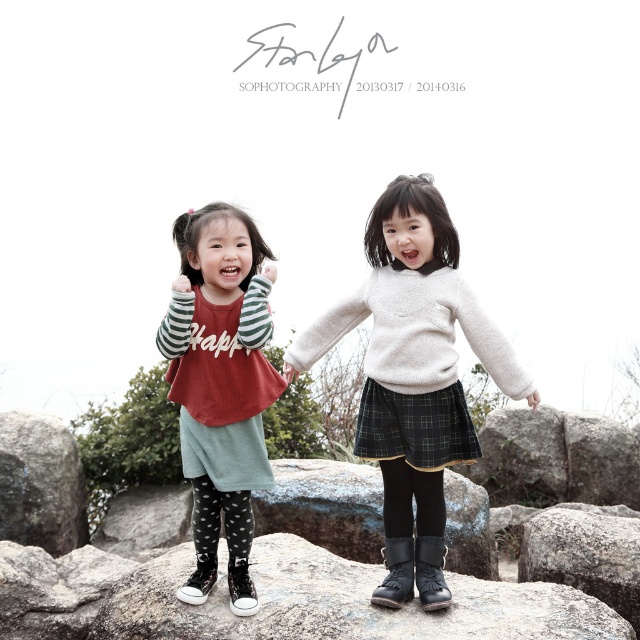
Based on the photo, you are a photographer trying to capture the two children in the scene. You want to ensure both the black textured boulder at center and the green cotton skirt at center are clearly visible in your shot. Based on their positions, which object should you focus on first to ensure both are in frame?

The black textured boulder at center is positioned on the right side of the green cotton skirt at center, so focusing on the green cotton skirt at center first will ensure the boulder is also in the frame to its right.

You are a drone operator trying to land a drone on a gray rough boulder at lower left. The drone has a GPS coordinate of point (40, 483). Is the drone currently above the gray rough boulder at lower left?

Yes, the drone is above the gray rough boulder at lower left because the point (40, 483) corresponds to the location of the gray rough boulder at lower left.